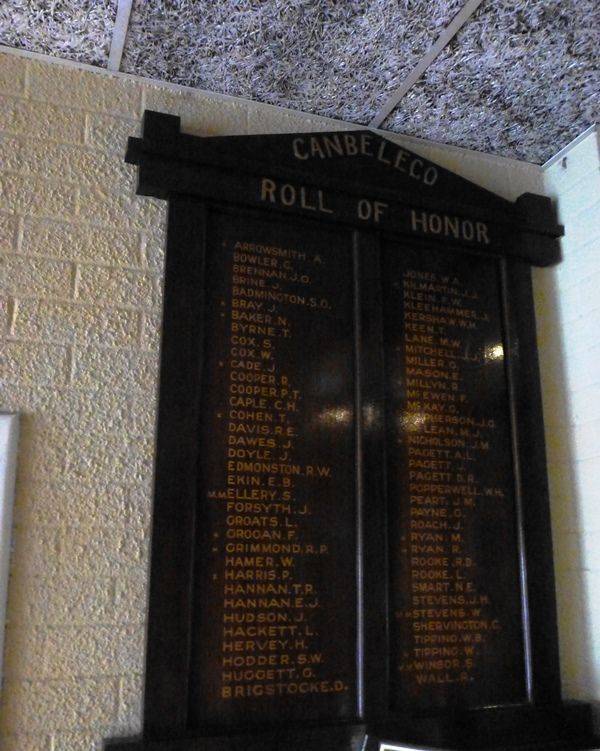
You are a GUI agent. You are given a task and a screenshot of the screen. Output one action in this format:
    pyautogui.click(x=<x>, y=<y>)
    Task: Click on the reflective glass
    
    Given the screenshot: What is the action you would take?
    pyautogui.click(x=453, y=607)